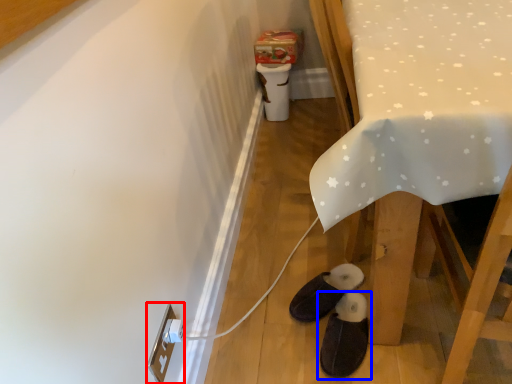
Question: Which point is further to the camera, electric outlet (highlighted by a red box) or footwear (highlighted by a blue box)?

Choices:
 (A) electric outlet
 (B) footwear

Answer: (B)